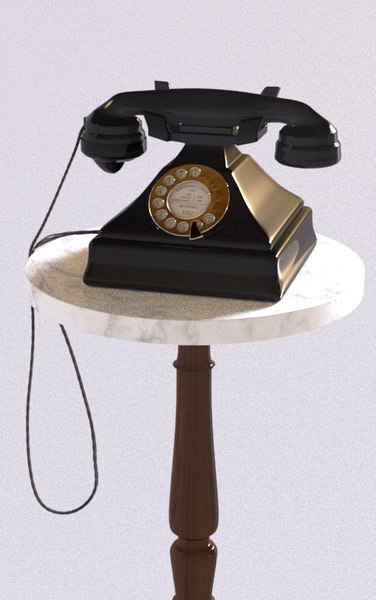
The image size is (376, 600). What are the coordinates of `marble` in the screenshot? It's located at (125, 322).